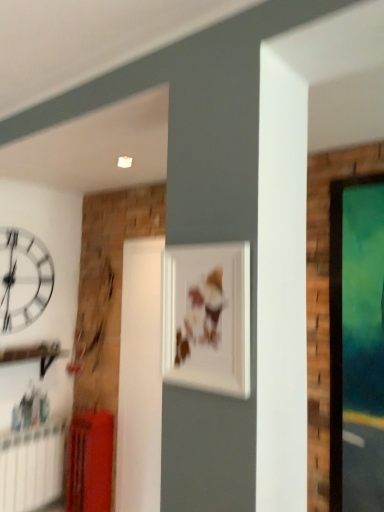
Describe the element at coordinates (31, 467) in the screenshot. I see `white plastic radiator at lower left` at that location.

What is the approximate height of matte white picture frame at center?

A: The height of matte white picture frame at center is 15.14 inches.

The image size is (384, 512). What do you see at coordinates (207, 317) in the screenshot?
I see `matte white picture frame at center` at bounding box center [207, 317].

At what (x,y) coordinates should I click in order to perform the action: click on white plastic radiator at lower left. Please return your answer as a coordinate pair (x, y). The width and height of the screenshot is (384, 512). Looking at the image, I should click on (31, 467).

Is matte red radiator at lower left next to matte white picture frame at center and touching it?

They are not placed beside each other.

Is matte red radiator at lower left taller than matte white picture frame at center?

Indeed, matte red radiator at lower left has a greater height compared to matte white picture frame at center.

Can matte white picture frame at center be found inside matte red radiator at lower left?

No, matte white picture frame at center is not a part of matte red radiator at lower left.

Do you think matte white picture frame at center is within white glossy clock at upper left, or outside of it?

matte white picture frame at center lies outside white glossy clock at upper left.

From the image's perspective, which is above, matte white picture frame at center or white glossy clock at upper left?

matte white picture frame at center, from the image's perspective.

Is matte white picture frame at center facing towards white glossy clock at upper left?

Answer: No.

How far apart are matte white picture frame at center and white glossy clock at upper left?

A distance of 2.44 meters exists between matte white picture frame at center and white glossy clock at upper left.

Does matte white picture frame at center come behind matte red radiator at lower left?

No.

From the image's perspective, who appears lower, matte white picture frame at center or matte red radiator at lower left?

matte red radiator at lower left.

From a real-world perspective, is matte white picture frame at center on top of matte red radiator at lower left?

Yes, from a real-world perspective, matte white picture frame at center is above matte red radiator at lower left.

How many degrees apart are the facing directions of matte red radiator at lower left and white glossy clock at upper left?

matte red radiator at lower left and white glossy clock at upper left are facing 89.5 degrees away from each other.

Between point (92, 455) and point (28, 267), which one is positioned behind?

Positioned behind is point (28, 267).

Which of these two, matte red radiator at lower left or white glossy clock at upper left, is bigger?

Bigger between the two is matte red radiator at lower left.

Considering the relative positions of matte red radiator at lower left and white glossy clock at upper left in the image provided, is matte red radiator at lower left in front of white glossy clock at upper left?

That is True.

This screenshot has width=384, height=512. Find the location of `wall clock lying above the matte red radiator at lower left (from the image's perspective)`. wall clock lying above the matte red radiator at lower left (from the image's perspective) is located at coordinates (23, 279).

In the scene shown: Which of these two, white glossy clock at upper left or matte red radiator at lower left, is wider?

With larger width is matte red radiator at lower left.

Is white glossy clock at upper left in front of matte red radiator at lower left?

No, white glossy clock at upper left is further to the viewer.

From the image's perspective, who appears lower, white glossy clock at upper left or matte red radiator at lower left?

matte red radiator at lower left, from the image's perspective.

Is matte red radiator at lower left positioned with its back to white plastic radiator at lower left?

No, matte red radiator at lower left is not facing the opposite direction of white plastic radiator at lower left.

Is matte red radiator at lower left positioned far away from white plastic radiator at lower left?

That's not correct — matte red radiator at lower left is a little close to white plastic radiator at lower left.

Based on the photo, between matte red radiator at lower left and white plastic radiator at lower left, which one has less height?

Standing shorter between the two is white plastic radiator at lower left.

Consider the image. Is white plastic radiator at lower left far away from white glossy clock at upper left?

Indeed, white plastic radiator at lower left is not near white glossy clock at upper left.

In the scene shown: Is white glossy clock at upper left a part of white plastic radiator at lower left?

No.

Is point (34, 457) more distant than point (36, 272)?

That is False.

Measure the distance from white plastic radiator at lower left to white glossy clock at upper left.

A distance of 3.57 feet exists between white plastic radiator at lower left and white glossy clock at upper left.

Identify the location of furniture beneath the matte white picture frame at center (from a real-world perspective). (90, 462).

Image resolution: width=384 pixels, height=512 pixels. What are the coordinates of `wall clock above the matte white picture frame at center (from a real-world perspective)` in the screenshot? It's located at (23, 279).

Looking at the image, which one is located closer to white plastic radiator at lower left, white glossy clock at upper left or matte red radiator at lower left?

matte red radiator at lower left.

Considering their positions, is matte white picture frame at center positioned closer to white glossy clock at upper left than white plastic radiator at lower left?

white plastic radiator at lower left lies closer to white glossy clock at upper left than the other object.

When comparing their distances from white glossy clock at upper left, does matte red radiator at lower left or matte white picture frame at center seem closer?

matte red radiator at lower left lies closer to white glossy clock at upper left than the other object.

From the image, which object appears to be nearer to white plastic radiator at lower left, matte white picture frame at center or white glossy clock at upper left?

white glossy clock at upper left.

Which object lies further to the anchor point white glossy clock at upper left, matte red radiator at lower left or white plastic radiator at lower left?

matte red radiator at lower left lies further to white glossy clock at upper left than the other object.

Estimate the real-world distances between objects in this image. Which object is further from white plastic radiator at lower left, matte white picture frame at center or matte red radiator at lower left?

matte white picture frame at center is positioned further to the anchor white plastic radiator at lower left.

Looking at the image, which one is located further to white plastic radiator at lower left, white glossy clock at upper left or matte white picture frame at center?

matte white picture frame at center lies further to white plastic radiator at lower left than the other object.

Which object lies further to the anchor point white glossy clock at upper left, matte white picture frame at center or matte red radiator at lower left?

Based on the image, matte white picture frame at center appears to be further to white glossy clock at upper left.

Where is `furniture between white glossy clock at upper left and white plastic radiator at lower left vertically`? The image size is (384, 512). furniture between white glossy clock at upper left and white plastic radiator at lower left vertically is located at coordinates (90, 462).

Identify the location of radiator positioned between matte white picture frame at center and white glossy clock at upper left from near to far. Image resolution: width=384 pixels, height=512 pixels. (31, 467).

The width and height of the screenshot is (384, 512). What are the coordinates of `furniture positioned between matte white picture frame at center and white glossy clock at upper left from near to far` in the screenshot? It's located at (90, 462).

What are the coordinates of `radiator between matte white picture frame at center and matte red radiator at lower left along the z-axis` in the screenshot? It's located at (31, 467).